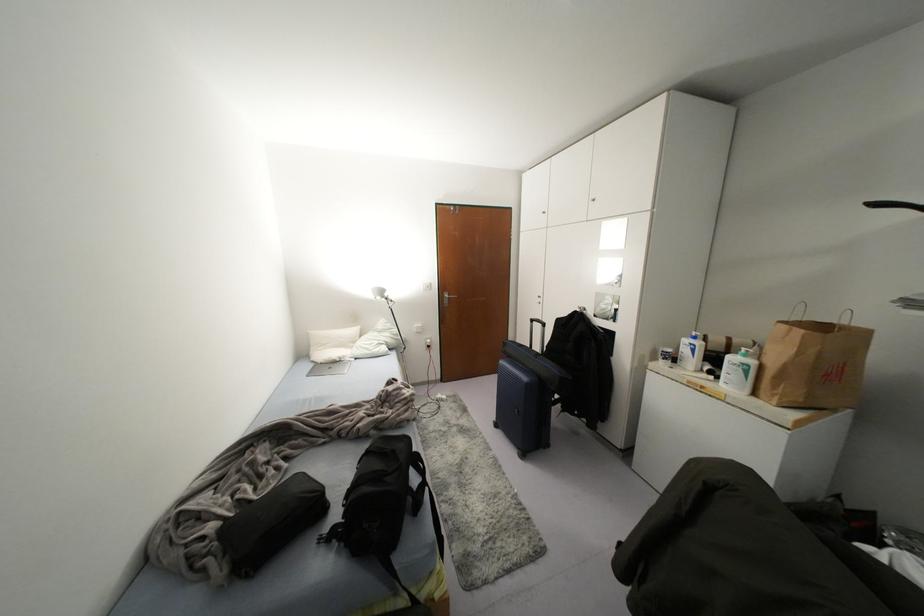
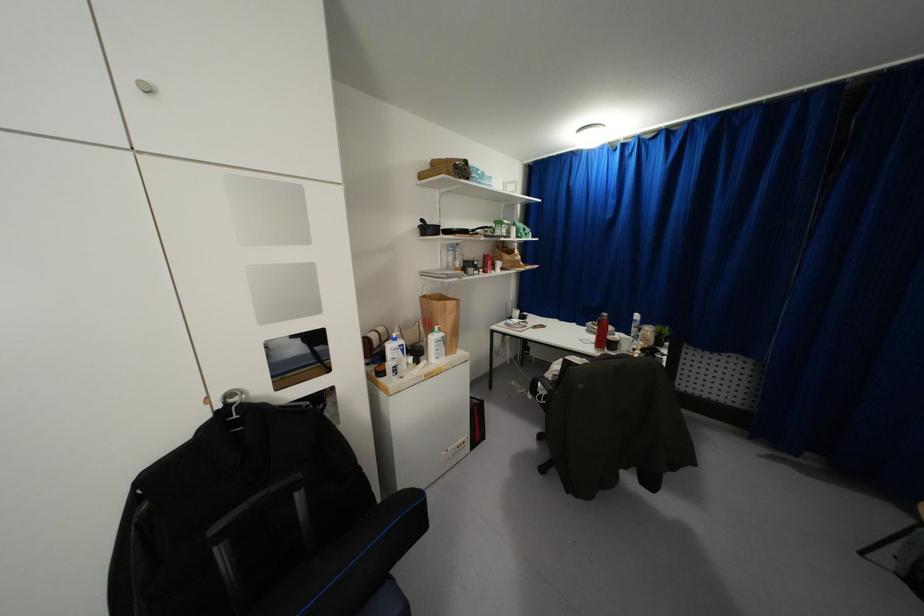
Find the pixel in the second image that matches point 876,204 in the first image.

(421, 220)